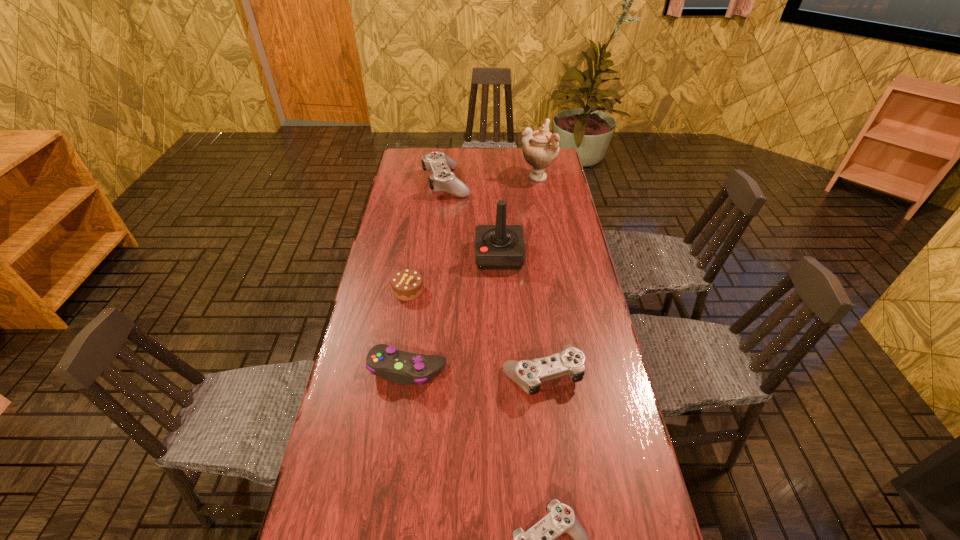
This screenshot has height=540, width=960. Identify the location of vacant space located on the front-facing side of the red joystick. (408, 255).

You are a GUI agent. You are given a task and a screenshot of the screen. Output one action in this format:
    pyautogui.click(x=<x>, y=<y>)
    Task: Click on the vacant region located on the front-facing side of the red joystick
    
    Given the screenshot: What is the action you would take?
    pyautogui.click(x=422, y=255)

Locate an element on the screen. free space located 0.130m on the front-facing side of the red joystick is located at coordinates (439, 255).

The image size is (960, 540). I want to click on vacant space situated 0.120m on the front of the biggest white control, so click(x=443, y=217).

The image size is (960, 540). Find the location of `vacant space situated 0.330m on the back of the gray control`. vacant space situated 0.330m on the back of the gray control is located at coordinates (421, 270).

The width and height of the screenshot is (960, 540). In order to click on free spot located 0.190m on the front of the second smallest white control in this screenshot , I will do `click(554, 476)`.

Find the location of a particular element. Image resolution: width=960 pixels, height=540 pixels. free point located on the back of the brown chocolate cake is located at coordinates (420, 217).

Locate an element on the screen. urn located at the far edge is located at coordinates (540, 148).

Find the location of `control positioned at the far edge`. control positioned at the far edge is located at coordinates (442, 178).

What are the coordinates of `chocolate cake that is at the left edge` in the screenshot? It's located at (407, 285).